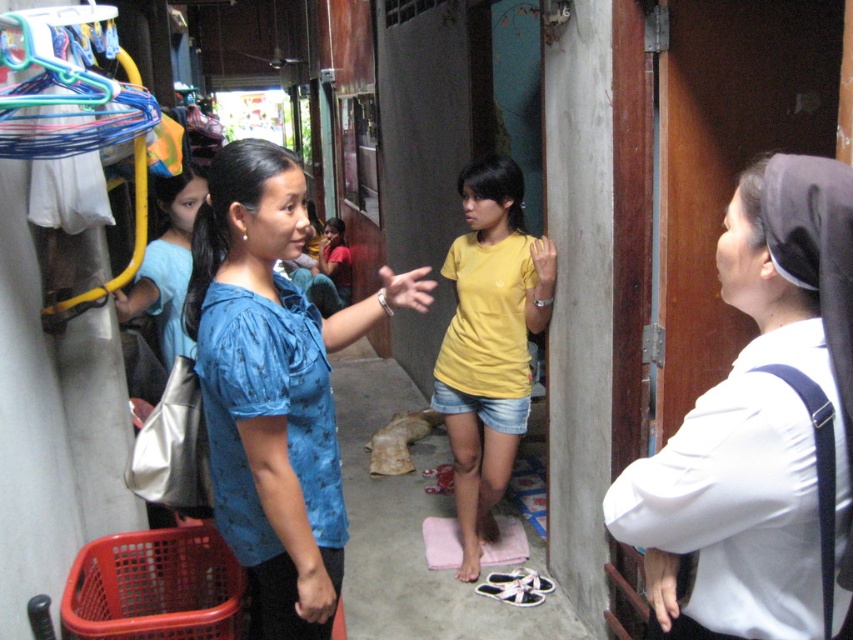
Looking at this image, you are standing in the corridor and want to take a photo of both point (817, 257) and point (521, 419). Which point should you focus on first to ensure both are in focus?

You should focus on point (817, 257) first because it is closer to the camera than point (521, 419), ensuring both will be in focus when using depth of field.

You are standing at point (x=395, y=304) and want to walk to the exit at the far end of the corridor. There is an obstacle at point (x=788, y=172). Will you be able to walk straight ahead without passing by the obstacle?

Point (x=788, y=172) is in front of point (x=395, y=304), so walking straight ahead towards the exit would require passing by the obstacle at point (x=788, y=172).